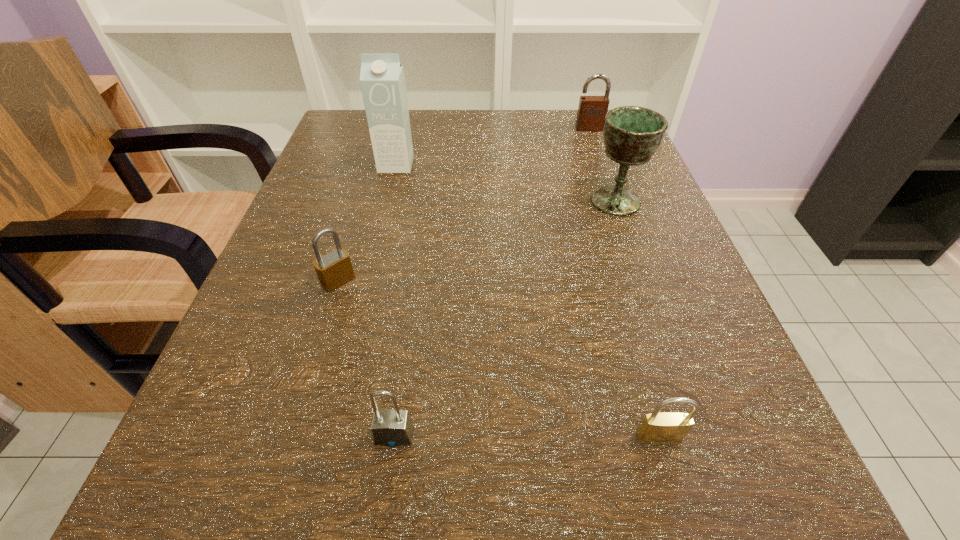
Where is `free space at the far edge of the desktop`? This screenshot has width=960, height=540. free space at the far edge of the desktop is located at coordinates (443, 151).

You are a GUI agent. You are given a task and a screenshot of the screen. Output one action in this format:
    pyautogui.click(x=<x>, y=<y>)
    Task: Click on the vacant space at the near edge
    The height and width of the screenshot is (540, 960).
    Given the screenshot: What is the action you would take?
    pyautogui.click(x=466, y=487)

In the image, there is a desktop. At what (x,y) coordinates should I click in order to perform the action: click on vacant space at the left edge. Please return your answer as a coordinate pair (x, y). Looking at the image, I should click on (221, 438).

The width and height of the screenshot is (960, 540). Identify the location of vacant space at the right edge. (578, 187).

You are a GUI agent. You are given a task and a screenshot of the screen. Output one action in this format:
    pyautogui.click(x=<x>, y=<y>)
    Task: Click on the vacant space at the far left corner of the desktop
    The image size is (960, 540).
    Given the screenshot: What is the action you would take?
    pyautogui.click(x=361, y=113)

Where is `free space at the near left corner of the desktop`? The width and height of the screenshot is (960, 540). free space at the near left corner of the desktop is located at coordinates (x=273, y=497).

Find the location of `vacant region between the fourth object from right to left and the leftmost padlock`. vacant region between the fourth object from right to left and the leftmost padlock is located at coordinates (366, 358).

This screenshot has width=960, height=540. Identify the location of free spot between the farthest object and the third object from left to right. (492, 282).

At what (x,y) coordinates should I click in order to perform the action: click on vacant area that lies between the second farthest object and the third padlock from right to left. Please return your answer as a coordinate pair (x, y). Looking at the image, I should click on (396, 300).

I want to click on empty location between the farthest padlock and the tallest object, so click(492, 146).